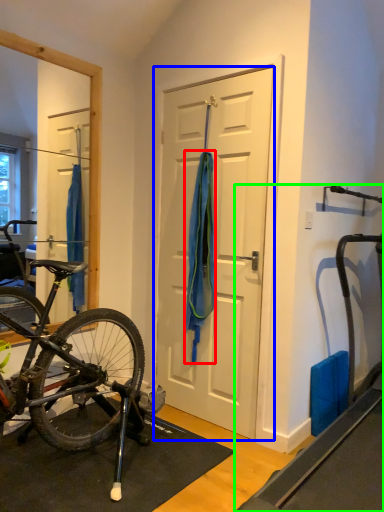
Question: Which object is positioned closest to towel/napkin (highlighted by a red box)? Select from door (highlighted by a blue box) and treadmill (highlighted by a green box).

Choices:
 (A) door
 (B) treadmill

Answer: (A)